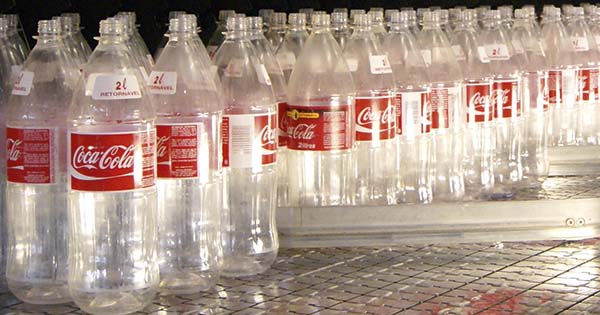
Locate an element on the screen. 2rd fully visible bottle from the left is located at coordinates (196, 138).